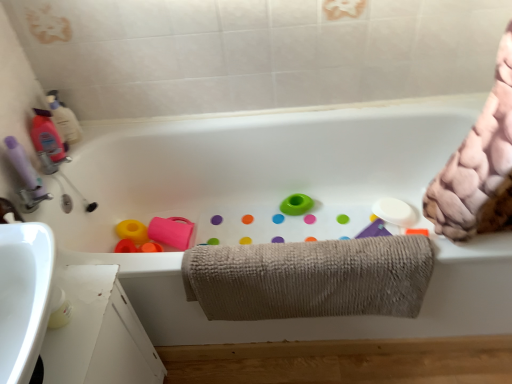
Where is `translucent plastic bottle at upper left, which ranks as the third cleaning product in bottom-to-top order`? The width and height of the screenshot is (512, 384). translucent plastic bottle at upper left, which ranks as the third cleaning product in bottom-to-top order is located at coordinates (64, 120).

Measure the distance between purple matte bottle at left, marked as the third cleaning product in a top-to-bottom arrangement, and camera.

A distance of 1.27 meters exists between purple matte bottle at left, marked as the third cleaning product in a top-to-bottom arrangement, and camera.

The height and width of the screenshot is (384, 512). Describe the element at coordinates (48, 142) in the screenshot. I see `matte pink bottle at left, acting as the 2th cleaning product starting from the bottom` at that location.

In the scene shown: What is the approximate height of white ceramic bathtub at center?

The height of white ceramic bathtub at center is 22.21 inches.

At what (x,y) coordinates should I click in order to perform the action: click on white ceramic bathtub at center. Please return your answer as a coordinate pair (x, y). Looking at the image, I should click on (276, 207).

Locate an element on the screen. translucent plastic bottle at upper left, which ranks as the third cleaning product in bottom-to-top order is located at coordinates (64, 120).

Is beige textured towel at center behind purple matte bottle at left, marked as the third cleaning product in a top-to-bottom arrangement?

No, beige textured towel at center is in front of purple matte bottle at left, marked as the third cleaning product in a top-to-bottom arrangement.

Looking at this image, from the image's perspective, is beige textured towel at center on purple matte bottle at left, marked as the third cleaning product in a top-to-bottom arrangement?

No, from the image's perspective, beige textured towel at center is not over purple matte bottle at left, marked as the third cleaning product in a top-to-bottom arrangement.

From the picture: Considering the relative positions of beige textured towel at center and purple matte bottle at left, marked as the third cleaning product in a top-to-bottom arrangement, in the image provided, is beige textured towel at center to the left or to the right of purple matte bottle at left, marked as the third cleaning product in a top-to-bottom arrangement,?

From the image, it's evident that beige textured towel at center is to the right of purple matte bottle at left, marked as the third cleaning product in a top-to-bottom arrangement.

Is beige textured towel at center wider than purple matte bottle at left, which ranks as the first cleaning product in bottom-to-top order?

Yes, beige textured towel at center is wider than purple matte bottle at left, which ranks as the first cleaning product in bottom-to-top order.

Would you say purple matte bottle at left, which ranks as the first cleaning product in bottom-to-top order, is inside or outside matte pink bottle at left, acting as the 2th cleaning product starting from the bottom?

purple matte bottle at left, which ranks as the first cleaning product in bottom-to-top order, cannot be found inside matte pink bottle at left, acting as the 2th cleaning product starting from the bottom.

Locate an element on the screen. The height and width of the screenshot is (384, 512). cleaning product on the left of matte pink bottle at left, acting as the 2th cleaning product starting from the bottom is located at coordinates (24, 167).

From the image's perspective, is purple matte bottle at left, marked as the third cleaning product in a top-to-bottom arrangement, located above matte pink bottle at left, the 2th cleaning product positioned from the top?

Incorrect, from the image's perspective, purple matte bottle at left, marked as the third cleaning product in a top-to-bottom arrangement, is lower than matte pink bottle at left, the 2th cleaning product positioned from the top.

Could you tell me if purple matte bottle at left, marked as the third cleaning product in a top-to-bottom arrangement, is turned towards matte pink bottle at left, acting as the 2th cleaning product starting from the bottom?

No, purple matte bottle at left, marked as the third cleaning product in a top-to-bottom arrangement, is not turned towards matte pink bottle at left, acting as the 2th cleaning product starting from the bottom.

Which of these two, translucent plastic bottle at upper left, which ranks as the third cleaning product in bottom-to-top order, or beige textured towel at center, is wider?

With larger width is beige textured towel at center.

From a real-world perspective, is translucent plastic bottle at upper left, which ranks as the third cleaning product in bottom-to-top order, positioned over beige textured towel at center based on gravity?

Yes, from a real-world perspective, translucent plastic bottle at upper left, which ranks as the third cleaning product in bottom-to-top order, is above beige textured towel at center.

In terms of height, does translucent plastic bottle at upper left, which ranks as the third cleaning product in bottom-to-top order, look taller or shorter compared to beige textured towel at center?

Considering their sizes, translucent plastic bottle at upper left, which ranks as the third cleaning product in bottom-to-top order, has less height than beige textured towel at center.

Find the location of a particular element. Image resolution: width=512 pixels, height=384 pixels. towel lying in front of the translucent plastic bottle at upper left, which ranks as the third cleaning product in bottom-to-top order is located at coordinates (310, 278).

The width and height of the screenshot is (512, 384). Find the location of `cleaning product directly beneath the translucent plastic bottle at upper left, which ranks as the third cleaning product in bottom-to-top order (from a real-world perspective)`. cleaning product directly beneath the translucent plastic bottle at upper left, which ranks as the third cleaning product in bottom-to-top order (from a real-world perspective) is located at coordinates (48, 142).

What's the angular difference between matte pink bottle at left, the 2th cleaning product positioned from the top, and translucent plastic bottle at upper left, arranged as the 1th cleaning product when viewed from the top,'s facing directions?

matte pink bottle at left, the 2th cleaning product positioned from the top, and translucent plastic bottle at upper left, arranged as the 1th cleaning product when viewed from the top, are facing 48.8 degrees away from each other.

Which is correct: matte pink bottle at left, the 2th cleaning product positioned from the top, is inside translucent plastic bottle at upper left, arranged as the 1th cleaning product when viewed from the top, or outside of it?

matte pink bottle at left, the 2th cleaning product positioned from the top, is not enclosed by translucent plastic bottle at upper left, arranged as the 1th cleaning product when viewed from the top.

Would you consider matte pink bottle at left, acting as the 2th cleaning product starting from the bottom, to be distant from translucent plastic bottle at upper left, arranged as the 1th cleaning product when viewed from the top?

No, matte pink bottle at left, acting as the 2th cleaning product starting from the bottom, is not far from translucent plastic bottle at upper left, arranged as the 1th cleaning product when viewed from the top.

In the image, is white ceramic bathtub at center on the left side or the right side of beige textured towel at center?

From the image, it's evident that white ceramic bathtub at center is to the left of beige textured towel at center.

Is point (151, 125) positioned behind point (365, 286)?

Yes, point (151, 125) is behind point (365, 286).

How many degrees apart are the facing directions of white ceramic bathtub at center and beige textured towel at center?

4e-05 degrees separate the facing orientations of white ceramic bathtub at center and beige textured towel at center.

Is white ceramic bathtub at center oriented towards beige textured towel at center?

Yes, white ceramic bathtub at center is oriented towards beige textured towel at center.

Which is closer, (27, 161) or (76, 138)?

Point (27, 161) is positioned closer to the camera compared to point (76, 138).

From the image's perspective, does purple matte bottle at left, which ranks as the first cleaning product in bottom-to-top order, appear higher than translucent plastic bottle at upper left, which ranks as the third cleaning product in bottom-to-top order?

Incorrect, from the image's perspective, purple matte bottle at left, which ranks as the first cleaning product in bottom-to-top order, is lower than translucent plastic bottle at upper left, which ranks as the third cleaning product in bottom-to-top order.

Based on their sizes in the image, would you say purple matte bottle at left, which ranks as the first cleaning product in bottom-to-top order, is bigger or smaller than translucent plastic bottle at upper left, which ranks as the third cleaning product in bottom-to-top order?

Considering their sizes, purple matte bottle at left, which ranks as the first cleaning product in bottom-to-top order, takes up more space than translucent plastic bottle at upper left, which ranks as the third cleaning product in bottom-to-top order.

Can you confirm if purple matte bottle at left, marked as the third cleaning product in a top-to-bottom arrangement, is positioned to the right of translucent plastic bottle at upper left, arranged as the 1th cleaning product when viewed from the top?

No.

Looking at the image, does beige textured towel at center seem bigger or smaller compared to white ceramic bathtub at center?

beige textured towel at center is smaller than white ceramic bathtub at center.

Choose the correct answer: Is beige textured towel at center inside white ceramic bathtub at center or outside it?

beige textured towel at center is inside white ceramic bathtub at center.

Is beige textured towel at center positioned with its back to white ceramic bathtub at center?

Yes, beige textured towel at center is facing away from white ceramic bathtub at center.

From the image's perspective, which is above, beige textured towel at center or white ceramic bathtub at center?

white ceramic bathtub at center.

The image size is (512, 384). Find the location of `towel on the right of the purple matte bottle at left, which ranks as the first cleaning product in bottom-to-top order`. towel on the right of the purple matte bottle at left, which ranks as the first cleaning product in bottom-to-top order is located at coordinates (310, 278).

What are the coordinates of `cleaning product that is the 2nd one above the matte pink bottle at left, acting as the 2th cleaning product starting from the bottom (from a real-world perspective)` in the screenshot? It's located at (24, 167).

Based on their spatial positions, is translucent plastic bottle at upper left, arranged as the 1th cleaning product when viewed from the top, or purple matte bottle at left, which ranks as the first cleaning product in bottom-to-top order, closer to beige textured towel at center?

The object closer to beige textured towel at center is purple matte bottle at left, which ranks as the first cleaning product in bottom-to-top order.

When comparing their distances from purple matte bottle at left, which ranks as the first cleaning product in bottom-to-top order, does white ceramic bathtub at center or translucent plastic bottle at upper left, arranged as the 1th cleaning product when viewed from the top, seem closer?

translucent plastic bottle at upper left, arranged as the 1th cleaning product when viewed from the top, lies closer to purple matte bottle at left, which ranks as the first cleaning product in bottom-to-top order, than the other object.

In the scene shown: Considering their positions, is translucent plastic bottle at upper left, which ranks as the third cleaning product in bottom-to-top order, positioned closer to white ceramic bathtub at center than beige textured towel at center?

beige textured towel at center is positioned closer to the anchor white ceramic bathtub at center.

Based on their spatial positions, is purple matte bottle at left, marked as the third cleaning product in a top-to-bottom arrangement, or translucent plastic bottle at upper left, which ranks as the third cleaning product in bottom-to-top order, closer to beige textured towel at center?

Among the two, purple matte bottle at left, marked as the third cleaning product in a top-to-bottom arrangement, is located nearer to beige textured towel at center.

Based on the photo, which object lies further to the anchor point purple matte bottle at left, which ranks as the first cleaning product in bottom-to-top order, white ceramic bathtub at center or beige textured towel at center?

The object further to purple matte bottle at left, which ranks as the first cleaning product in bottom-to-top order, is beige textured towel at center.

Based on their spatial positions, is matte pink bottle at left, acting as the 2th cleaning product starting from the bottom, or beige textured towel at center further from purple matte bottle at left, which ranks as the first cleaning product in bottom-to-top order?

Based on the image, beige textured towel at center appears to be further to purple matte bottle at left, which ranks as the first cleaning product in bottom-to-top order.

Looking at the image, which one is located further to matte pink bottle at left, the 2th cleaning product positioned from the top, translucent plastic bottle at upper left, arranged as the 1th cleaning product when viewed from the top, or white ceramic bathtub at center?

The object further to matte pink bottle at left, the 2th cleaning product positioned from the top, is white ceramic bathtub at center.

Looking at the image, which one is located further to matte pink bottle at left, the 2th cleaning product positioned from the top, beige textured towel at center or purple matte bottle at left, marked as the third cleaning product in a top-to-bottom arrangement?

beige textured towel at center is positioned further to the anchor matte pink bottle at left, the 2th cleaning product positioned from the top.

The image size is (512, 384). I want to click on cleaning product located between matte pink bottle at left, the 2th cleaning product positioned from the top, and beige textured towel at center in the left-right direction, so click(64, 120).

The height and width of the screenshot is (384, 512). Identify the location of bathtub situated between translucent plastic bottle at upper left, which ranks as the third cleaning product in bottom-to-top order, and beige textured towel at center from left to right. (276, 207).

You are a GUI agent. You are given a task and a screenshot of the screen. Output one action in this format:
    pyautogui.click(x=<x>, y=<y>)
    Task: Click on the bathtub between purple matte bottle at left, which ranks as the first cleaning product in bottom-to-top order, and beige textured towel at center
    
    Given the screenshot: What is the action you would take?
    pyautogui.click(x=276, y=207)

Where is `cleaning product located between purple matte bottle at left, marked as the third cleaning product in a top-to-bottom arrangement, and translucent plastic bottle at upper left, arranged as the 1th cleaning product when viewed from the top, in the depth direction`? Image resolution: width=512 pixels, height=384 pixels. cleaning product located between purple matte bottle at left, marked as the third cleaning product in a top-to-bottom arrangement, and translucent plastic bottle at upper left, arranged as the 1th cleaning product when viewed from the top, in the depth direction is located at coordinates (48, 142).